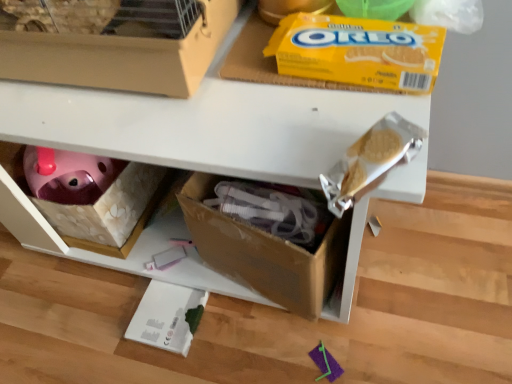
Identify the location of vacant area that is in front of yellow cardboard oreo at upper center. This screenshot has height=384, width=512. (347, 119).